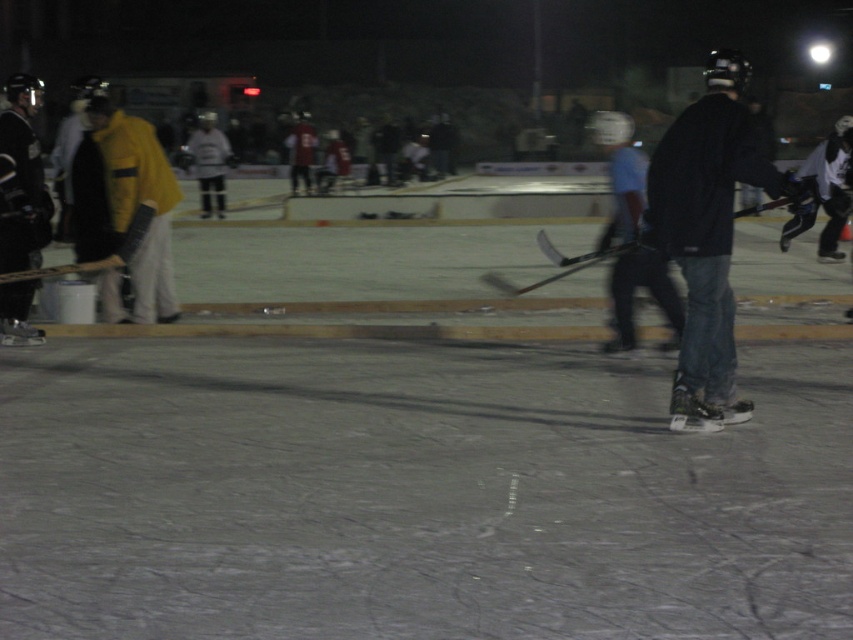
Question: Among these points, which one is nearest to the camera?

Choices:
 (A) (x=131, y=163)
 (B) (x=318, y=561)
 (C) (x=793, y=227)

Answer: (B)

Question: Which object appears closest to the camera in this image?

Choices:
 (A) white matte hockey player at upper center
 (B) matte black hockey stick at left

Answer: (B)

Question: Among these objects, which one is farthest from the camera?

Choices:
 (A) matte black hockey stick at center
 (B) white matte hockey player at upper center
 (C) black matte jacket at right
 (D) white ice at center

Answer: (B)

Question: Does white matte hockey player at upper center have a greater width compared to matte black hockey stick at left?

Choices:
 (A) yes
 (B) no

Answer: (A)

Question: Can you confirm if yellow matte jacket at left is positioned above white matte hockey player at upper center?

Choices:
 (A) no
 (B) yes

Answer: (A)

Question: Can you confirm if white matte hockey player at upper center is bigger than matte black hockey stick at left?

Choices:
 (A) yes
 (B) no

Answer: (A)